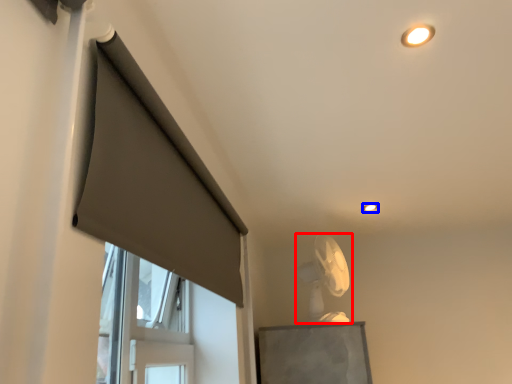
Question: Which point is closer to the camera, fan (highlighted by a red box) or lighting (highlighted by a blue box)?

Choices:
 (A) fan
 (B) lighting

Answer: (A)